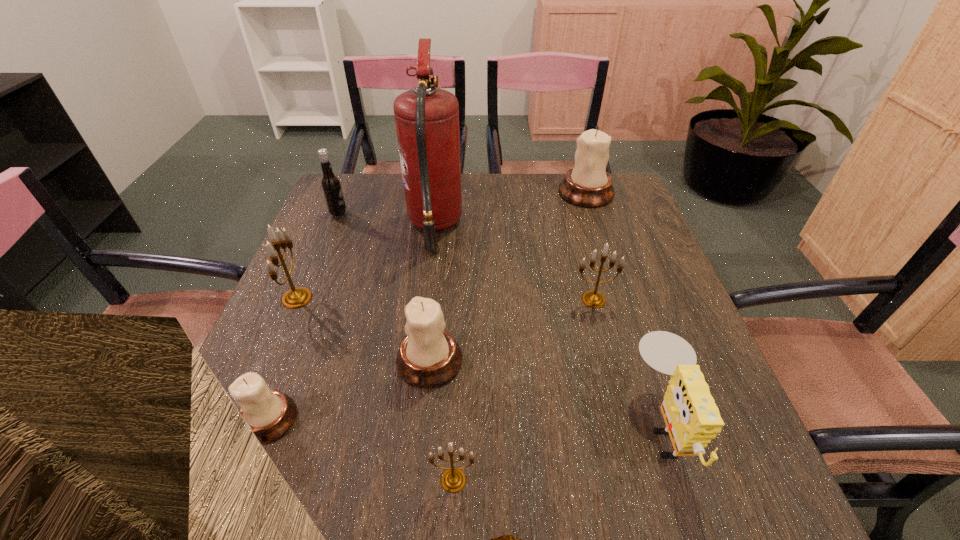
Locate which object is the third closest to the nearest white candle holder. Please provide its 2D coordinates. Your answer should be formatted as a tuple, i.e. [(x, y)], where the tuple contains the x and y coordinates of a point satisfying the conditions above.

[(453, 480)]

You are a GUI agent. You are given a task and a screenshot of the screen. Output one action in this format:
    pyautogui.click(x=<x>, y=<y>)
    Task: Click on the closest candelabrum to the farthest candelabrum
    
    Given the screenshot: What is the action you would take?
    point(593,299)

Locate an element on the screen. Image resolution: width=960 pixels, height=540 pixels. candelabrum object that ranks as the second closest to the second smallest white candle holder is located at coordinates (270, 414).

At what (x,y) coordinates should I click in order to perform the action: click on white candle holder that is the closest to the rightmost gold candelabrum. Please return your answer as a coordinate pair (x, y). The height and width of the screenshot is (540, 960). Looking at the image, I should click on (429, 356).

Locate which white candle holder ranks in proximity to the fourth farthest candelabrum. Please provide its 2D coordinates. Your answer should be formatted as a tuple, i.e. [(x, y)], where the tuple contains the x and y coordinates of a point satisfying the conditions above.

[(270, 414)]

Locate an element on the screen. This screenshot has width=960, height=540. gold candelabrum that is the second closest to the second biggest gold candelabrum is located at coordinates (297, 297).

Choose which gold candelabrum is the third nearest neighbor to the rightmost white candle holder. Please provide its 2D coordinates. Your answer should be formatted as a tuple, i.e. [(x, y)], where the tuple contains the x and y coordinates of a point satisfying the conditions above.

[(453, 480)]

I want to click on vacant position in the image that satisfies the following two spatial constraints: 1. on the label of the root beer; 2. on the back side of the second smallest gold candelabrum, so click(303, 300).

Where is `blank area in the image that satisfies the following two spatial constraints: 1. on the label of the second biggest gold candelabrum; 2. on the right side of the root beer`? blank area in the image that satisfies the following two spatial constraints: 1. on the label of the second biggest gold candelabrum; 2. on the right side of the root beer is located at coordinates (303, 300).

Locate an element on the screen. vacant region that satisfies the following two spatial constraints: 1. on the label of the root beer; 2. on the left side of the second biggest white candle holder is located at coordinates (279, 360).